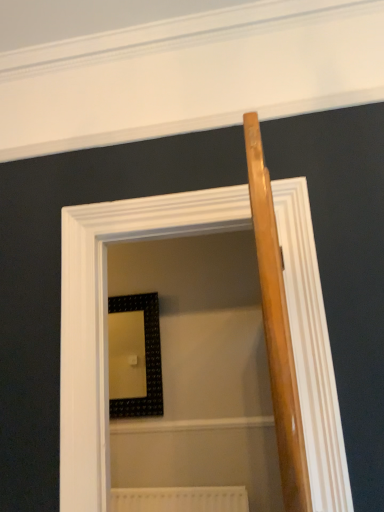
Question: Can you confirm if white textured radiator at lower center is wider than black textured picture frame at center?

Choices:
 (A) no
 (B) yes

Answer: (A)

Question: Is white textured radiator at lower center looking in the opposite direction of black textured picture frame at center?

Choices:
 (A) yes
 (B) no

Answer: (B)

Question: Can you confirm if white textured radiator at lower center is positioned to the left of black textured picture frame at center?

Choices:
 (A) no
 (B) yes

Answer: (A)

Question: Is black textured picture frame at center inside white textured radiator at lower center?

Choices:
 (A) yes
 (B) no

Answer: (B)

Question: Is white textured radiator at lower center located outside black textured picture frame at center?

Choices:
 (A) yes
 (B) no

Answer: (A)

Question: Could you tell me if white textured radiator at lower center is facing black textured picture frame at center?

Choices:
 (A) yes
 (B) no

Answer: (B)

Question: Does wooden screen door at center have a greater height compared to white textured radiator at lower center?

Choices:
 (A) yes
 (B) no

Answer: (A)

Question: From a real-world perspective, is wooden screen door at center physically above white textured radiator at lower center?

Choices:
 (A) no
 (B) yes

Answer: (B)

Question: Is wooden screen door at center directly adjacent to white textured radiator at lower center?

Choices:
 (A) no
 (B) yes

Answer: (A)

Question: Is wooden screen door at center positioned before white textured radiator at lower center?

Choices:
 (A) yes
 (B) no

Answer: (A)

Question: From the image's perspective, is wooden screen door at center on white textured radiator at lower center?

Choices:
 (A) yes
 (B) no

Answer: (A)

Question: Can you confirm if wooden screen door at center is wider than white textured radiator at lower center?

Choices:
 (A) yes
 (B) no

Answer: (A)

Question: Can you confirm if black textured picture frame at center is positioned to the right of wooden screen door at center?

Choices:
 (A) yes
 (B) no

Answer: (B)